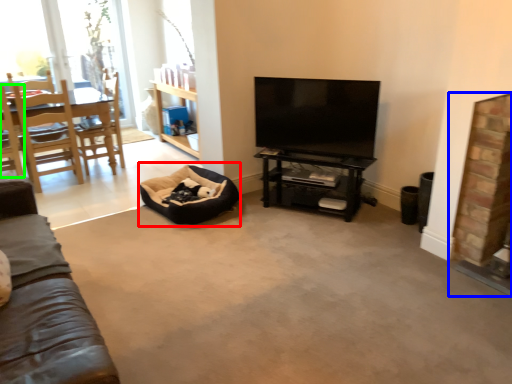
Question: Which object is positioned closest to bean bag chair (highlighted by a red box)? Select from fireplace (highlighted by a blue box) and chair (highlighted by a green box).

Choices:
 (A) fireplace
 (B) chair

Answer: (B)